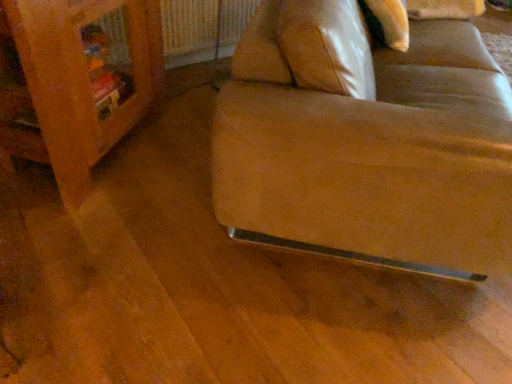
Question: Would you say metallic silver radiator at upper center is outside leather at lower right?

Choices:
 (A) yes
 (B) no

Answer: (A)

Question: From a real-world perspective, does metallic silver radiator at upper center sit lower than leather at lower right?

Choices:
 (A) yes
 (B) no

Answer: (A)

Question: Could you tell me if metallic silver radiator at upper center is turned towards leather at lower right?

Choices:
 (A) yes
 (B) no

Answer: (A)

Question: Can you confirm if metallic silver radiator at upper center is wider than leather at lower right?

Choices:
 (A) yes
 (B) no

Answer: (B)

Question: Is metallic silver radiator at upper center at the right side of leather at lower right?

Choices:
 (A) yes
 (B) no

Answer: (B)

Question: Is wooden bookshelf at left inside the boundaries of metallic silver radiator at upper center, or outside?

Choices:
 (A) outside
 (B) inside

Answer: (A)

Question: Does point (80, 124) appear closer or farther from the camera than point (172, 41)?

Choices:
 (A) farther
 (B) closer

Answer: (B)

Question: From the image's perspective, is wooden bookshelf at left located above or below metallic silver radiator at upper center?

Choices:
 (A) above
 (B) below

Answer: (B)

Question: Considering the relative positions of wooden bookshelf at left and metallic silver radiator at upper center in the image provided, is wooden bookshelf at left to the left or to the right of metallic silver radiator at upper center?

Choices:
 (A) right
 (B) left

Answer: (B)

Question: Would you say leather at lower right is inside or outside metallic silver radiator at upper center?

Choices:
 (A) inside
 (B) outside

Answer: (B)

Question: Visually, is leather at lower right positioned to the left or to the right of metallic silver radiator at upper center?

Choices:
 (A) right
 (B) left

Answer: (A)

Question: Looking at the image, does leather at lower right seem bigger or smaller compared to metallic silver radiator at upper center?

Choices:
 (A) big
 (B) small

Answer: (A)

Question: In terms of width, does leather at lower right look wider or thinner when compared to metallic silver radiator at upper center?

Choices:
 (A) wide
 (B) thin

Answer: (A)

Question: Is metallic silver radiator at upper center in front of or behind leather at lower right in the image?

Choices:
 (A) front
 (B) behind

Answer: (B)

Question: Is point (193, 49) closer or farther from the camera than point (448, 41)?

Choices:
 (A) closer
 (B) farther

Answer: (B)